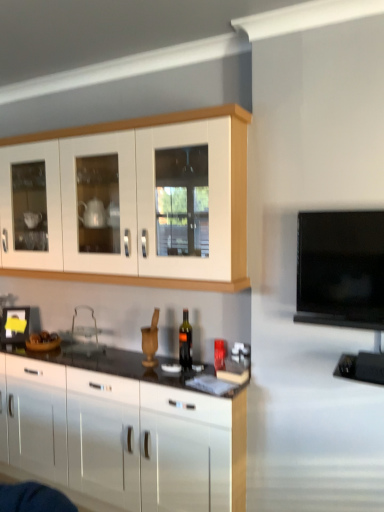
Question: From a real-world perspective, is flat screen tv at right above or below white glossy cabinet at upper left, positioned as the 2th cabinetry in bottom-to-top order?

Choices:
 (A) above
 (B) below

Answer: (B)

Question: Is flat screen tv at right taller or shorter than white glossy cabinet at upper left, positioned as the 2th cabinetry in bottom-to-top order?

Choices:
 (A) short
 (B) tall

Answer: (A)

Question: Considering the real-world distances, which object is farthest from the dark glass bottle at center?

Choices:
 (A) flat screen tv at right
 (B) white glossy cabinet at upper left, positioned as the 2th cabinetry in bottom-to-top order
 (C) glossy white cabinets at center, the first cabinetry ordered from the bottom

Answer: (A)

Question: Which object is positioned closest to the flat screen tv at right?

Choices:
 (A) dark glass bottle at center
 (B) glossy white cabinets at center, the first cabinetry ordered from the bottom
 (C) white glossy cabinet at upper left, positioned as the 2th cabinetry in bottom-to-top order

Answer: (C)